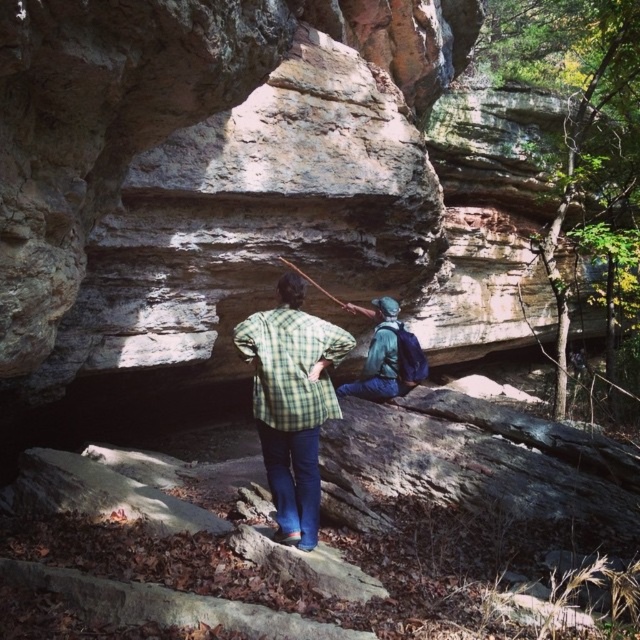
From the picture: Is green plaid shirt at center taller than blue-green fabric backpack at center?

Indeed, green plaid shirt at center has a greater height compared to blue-green fabric backpack at center.

Who is taller, green plaid shirt at center or blue-green fabric backpack at center?

green plaid shirt at center

Where is `green plaid shirt at center`? The height and width of the screenshot is (640, 640). green plaid shirt at center is located at coordinates (291, 403).